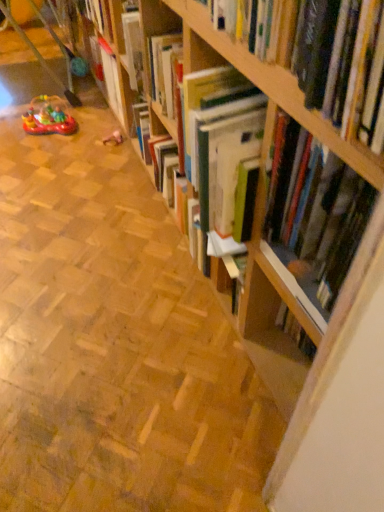
Measure the distance between point (313, 112) and camera.

Point (313, 112) and camera are 23.07 inches apart.

Measure the distance between wooden bookshelf at center and camera.

A distance of 96.94 centimeters exists between wooden bookshelf at center and camera.

The width and height of the screenshot is (384, 512). In order to click on wooden bookshelf at center in this screenshot , I will do `click(114, 344)`.

This screenshot has width=384, height=512. Describe the element at coordinates (114, 138) in the screenshot. I see `rubberized plastic toy at center, which is the first toy in right-to-left order` at that location.

This screenshot has height=512, width=384. Find the location of `rubberized plastic toy at center, the second toy in the left-to-right sequence`. rubberized plastic toy at center, the second toy in the left-to-right sequence is located at coordinates (114, 138).

Where is `wooden bookcase at upper right`? Image resolution: width=384 pixels, height=512 pixels. wooden bookcase at upper right is located at coordinates (262, 156).

From a real-world perspective, is rubberized plastic toy at center, the second toy in the left-to-right sequence, above or below rubber boat at left, acting as the first toy starting from the left?

rubberized plastic toy at center, the second toy in the left-to-right sequence, is situated lower than rubber boat at left, acting as the first toy starting from the left, in the real world.

Between point (122, 141) and point (53, 106), which one is positioned behind?

The point (53, 106) is more distant.

The image size is (384, 512). In order to click on toy above the rubberized plastic toy at center, the second toy in the left-to-right sequence (from a real-world perspective) in this screenshot , I will do `click(48, 117)`.

Is the depth of rubberized plastic toy at center, the second toy in the left-to-right sequence, greater than that of rubber boat at left, placed as the second toy when sorted from right to left?

Yes, it is.

How far apart are wooden bookshelf at center and wooden bookcase at upper right?

18.42 inches.

Considering the sizes of wooden bookshelf at center and wooden bookcase at upper right in the image, is wooden bookshelf at center taller or shorter than wooden bookcase at upper right?

In the image, wooden bookshelf at center appears to be shorter than wooden bookcase at upper right.

Based on the photo, would you consider wooden bookshelf at center to be distant from wooden bookcase at upper right?

They are positioned close to each other.

Considering their positions, is wooden bookshelf at center located in front of or behind wooden bookcase at upper right?

Clearly, wooden bookshelf at center is behind wooden bookcase at upper right.

In the scene shown: From their relative heights in the image, would you say rubber boat at left, placed as the second toy when sorted from right to left, is taller or shorter than hardcover book at upper right?

Clearly, rubber boat at left, placed as the second toy when sorted from right to left, is shorter compared to hardcover book at upper right.

Is rubber boat at left, placed as the second toy when sorted from right to left, further to the viewer compared to hardcover book at upper right?

Yes, rubber boat at left, placed as the second toy when sorted from right to left, is further from the viewer.

Would you say rubber boat at left, acting as the first toy starting from the left, is outside hardcover book at upper right?

Absolutely, rubber boat at left, acting as the first toy starting from the left, is external to hardcover book at upper right.

Between rubber boat at left, acting as the first toy starting from the left, and hardcover book at upper right, which one has smaller size?

Smaller between the two is rubber boat at left, acting as the first toy starting from the left.

Which of these two, wooden bookcase at upper right or rubberized plastic toy at center, which is the first toy in right-to-left order, is smaller?

Smaller between the two is rubberized plastic toy at center, which is the first toy in right-to-left order.

Considering the positions of objects wooden bookcase at upper right and rubberized plastic toy at center, the second toy in the left-to-right sequence, in the image provided, who is more to the right, wooden bookcase at upper right or rubberized plastic toy at center, the second toy in the left-to-right sequence,?

Positioned to the right is wooden bookcase at upper right.

Is wooden bookcase at upper right behind rubberized plastic toy at center, the second toy in the left-to-right sequence?

No, the depth of wooden bookcase at upper right is less than that of rubberized plastic toy at center, the second toy in the left-to-right sequence.

Identify the location of aisle that is below the rubber boat at left, acting as the first toy starting from the left (from the image's perspective). (114, 344).

Considering the sizes of objects rubber boat at left, acting as the first toy starting from the left, and wooden bookshelf at center in the image provided, who is taller, rubber boat at left, acting as the first toy starting from the left, or wooden bookshelf at center?

rubber boat at left, acting as the first toy starting from the left, is taller.

Which is in front, rubber boat at left, acting as the first toy starting from the left, or wooden bookshelf at center?

wooden bookshelf at center is in front.

Which of these two, rubber boat at left, placed as the second toy when sorted from right to left, or wooden bookshelf at center, is bigger?

With larger size is wooden bookshelf at center.

Is there a large distance between hardcover book at upper right and rubber boat at left, placed as the second toy when sorted from right to left?

hardcover book at upper right is positioned a significant distance from rubber boat at left, placed as the second toy when sorted from right to left.

Consider the image. Is hardcover book at upper right positioned behind rubber boat at left, placed as the second toy when sorted from right to left?

That is False.

Is hardcover book at upper right to the left of rubber boat at left, placed as the second toy when sorted from right to left, from the viewer's perspective?

No, hardcover book at upper right is not to the left of rubber boat at left, placed as the second toy when sorted from right to left.

The image size is (384, 512). I want to click on toy that is the 1st one below the hardcover book at upper right (from a real-world perspective), so click(48, 117).

From the image's perspective, is rubber boat at left, placed as the second toy when sorted from right to left, positioned above or below wooden bookcase at upper right?

rubber boat at left, placed as the second toy when sorted from right to left, is above wooden bookcase at upper right.

Is rubber boat at left, acting as the first toy starting from the left, looking in the opposite direction of wooden bookcase at upper right?

No, rubber boat at left, acting as the first toy starting from the left,'s orientation is not away from wooden bookcase at upper right.

In the image, there is a rubberized plastic toy at center, which is the first toy in right-to-left order. Where is `toy above it (from the image's perspective)`? This screenshot has height=512, width=384. toy above it (from the image's perspective) is located at coordinates (48, 117).

The image size is (384, 512). Identify the location of bookcase below the wooden bookshelf at center (from the image's perspective). (262, 156).

Looking at the image, which one is located further to rubber boat at left, acting as the first toy starting from the left, wooden bookcase at upper right or rubberized plastic toy at center, the second toy in the left-to-right sequence?

wooden bookcase at upper right is further to rubber boat at left, acting as the first toy starting from the left.

From the picture: Which object lies nearer to the anchor point rubber boat at left, placed as the second toy when sorted from right to left, wooden bookshelf at center or rubberized plastic toy at center, which is the first toy in right-to-left order?

Among the two, rubberized plastic toy at center, which is the first toy in right-to-left order, is located nearer to rubber boat at left, placed as the second toy when sorted from right to left.

From the picture: Based on their spatial positions, is rubberized plastic toy at center, which is the first toy in right-to-left order, or rubber boat at left, placed as the second toy when sorted from right to left, further from wooden bookcase at upper right?

rubberized plastic toy at center, which is the first toy in right-to-left order.

Considering their positions, is hardcover book at upper right positioned further to rubber boat at left, acting as the first toy starting from the left, than rubberized plastic toy at center, the second toy in the left-to-right sequence?

Based on the image, hardcover book at upper right appears to be further to rubber boat at left, acting as the first toy starting from the left.

Estimate the real-world distances between objects in this image. Which object is further from wooden bookshelf at center, hardcover book at upper right or rubberized plastic toy at center, the second toy in the left-to-right sequence?

Based on the image, rubberized plastic toy at center, the second toy in the left-to-right sequence, appears to be further to wooden bookshelf at center.

Based on their spatial positions, is rubberized plastic toy at center, which is the first toy in right-to-left order, or wooden bookshelf at center further from wooden bookcase at upper right?

rubberized plastic toy at center, which is the first toy in right-to-left order, is positioned further to the anchor wooden bookcase at upper right.

Based on the photo, estimate the real-world distances between objects in this image. Which object is further from wooden bookshelf at center, rubberized plastic toy at center, the second toy in the left-to-right sequence, or wooden bookcase at upper right?

rubberized plastic toy at center, the second toy in the left-to-right sequence, lies further to wooden bookshelf at center than the other object.

Looking at the image, which one is located closer to rubberized plastic toy at center, which is the first toy in right-to-left order, wooden bookcase at upper right or hardcover book at upper right?

wooden bookcase at upper right.

Where is `bookcase between wooden bookshelf at center and hardcover book at upper right from left to right`? bookcase between wooden bookshelf at center and hardcover book at upper right from left to right is located at coordinates tap(262, 156).

This screenshot has height=512, width=384. Identify the location of toy between wooden bookshelf at center and rubberized plastic toy at center, the second toy in the left-to-right sequence, from front to back. (48, 117).

This screenshot has height=512, width=384. Find the location of `aisle located between wooden bookcase at upper right and rubberized plastic toy at center, which is the first toy in right-to-left order, in the depth direction`. aisle located between wooden bookcase at upper right and rubberized plastic toy at center, which is the first toy in right-to-left order, in the depth direction is located at coordinates (114, 344).

Locate an element on the screen. toy positioned between hardcover book at upper right and rubberized plastic toy at center, which is the first toy in right-to-left order, from near to far is located at coordinates click(x=48, y=117).